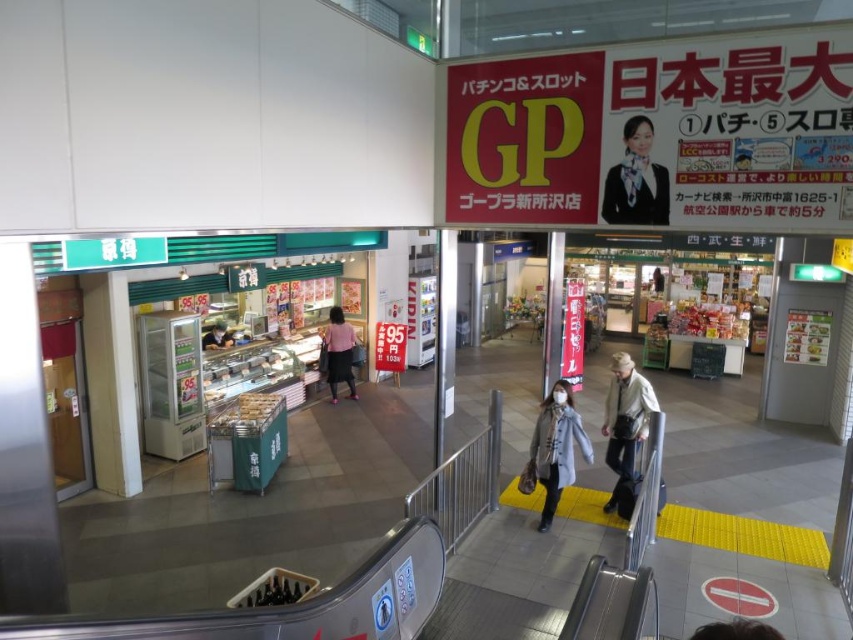
You are a customer in the shopping area and want to find the staff member in the matte black uniform at upper right to ask for assistance. However, there is also a person wearing a light gray wool coat at center. Which staff member is smaller in size?

The matte black uniform at upper right has a smaller size compared to the light gray wool coat at center, so the staff member in the matte black uniform at upper right is smaller in size.

You are standing in the shopping area of the train station and want to reach a specific location. You see two points marked as point 1 at coordinates (618, 164) and point 2 at coordinates (547, 432). Which point is closer to you?

Point 1 at coordinates (618, 164) is closer to you than point 2 at coordinates (547, 432).